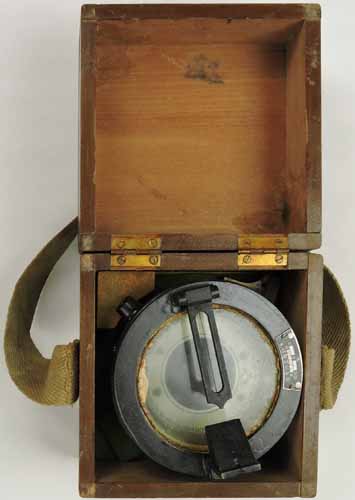
Where is `screws`? This screenshot has width=355, height=500. screws is located at coordinates (153, 259), (120, 261), (246, 259), (279, 258), (278, 242), (246, 244), (153, 245), (119, 243).